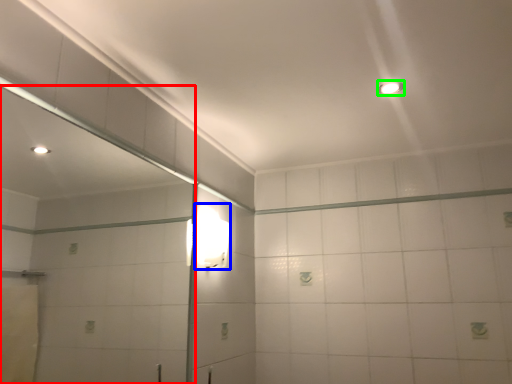
Question: Considering the real-world distances, which object is closest to mirror (highlighted by a red box)? light fixture (highlighted by a blue box) or light fixture (highlighted by a green box).

Choices:
 (A) light fixture
 (B) light fixture

Answer: (A)